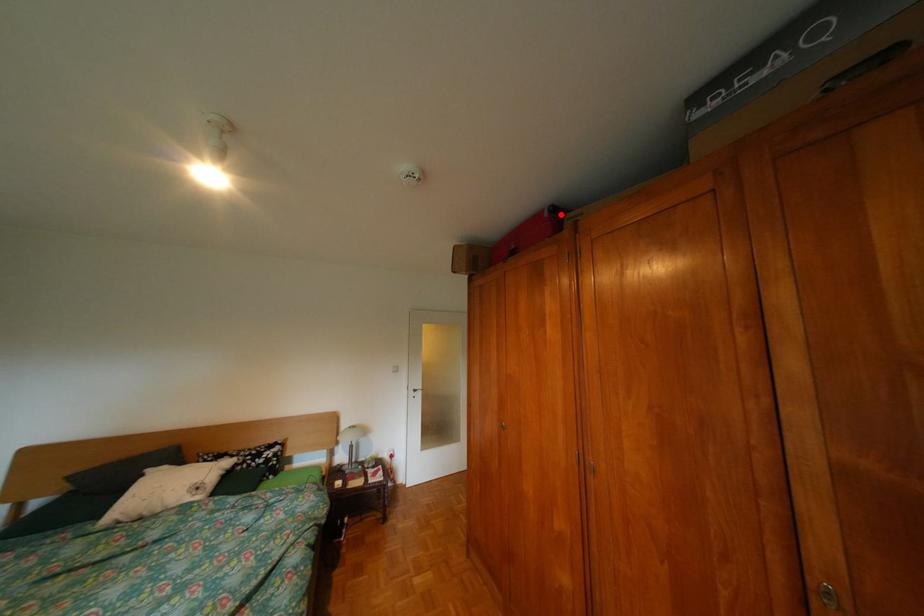
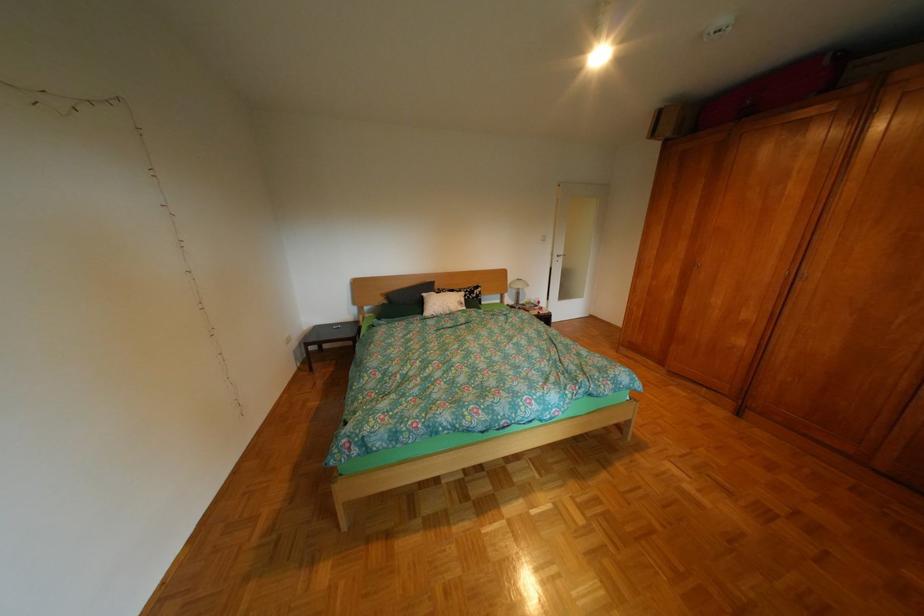
Find the pixel in the second image that matches the highlighted location in the first image.

(842, 63)